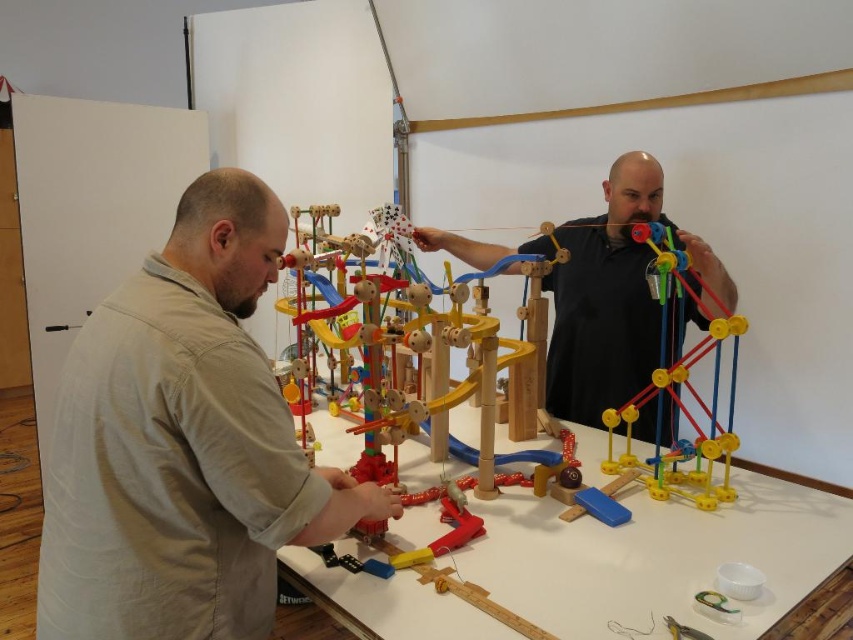
Question: Is the position of black matte man at center less distant than that of yellow plastic ball at center?

Choices:
 (A) no
 (B) yes

Answer: (A)

Question: Based on their relative distances, which object is farther from the yellow plastic ball at center?

Choices:
 (A) black matte man at center
 (B) wooden at center
 (C) light beige shirt at center

Answer: (C)

Question: Does light beige shirt at center have a lesser width compared to black matte man at center?

Choices:
 (A) yes
 (B) no

Answer: (A)

Question: Estimate the real-world distances between objects in this image. Which object is farther from the yellow plastic ball at center?

Choices:
 (A) black matte man at center
 (B) light beige shirt at center
 (C) wooden at center

Answer: (B)

Question: Can you confirm if light beige shirt at center is thinner than yellow plastic ball at center?

Choices:
 (A) yes
 (B) no

Answer: (A)

Question: Among these objects, which one is farthest from the camera?

Choices:
 (A) wooden at center
 (B) black matte man at center
 (C) light beige shirt at center
 (D) yellow plastic ball at center

Answer: (B)